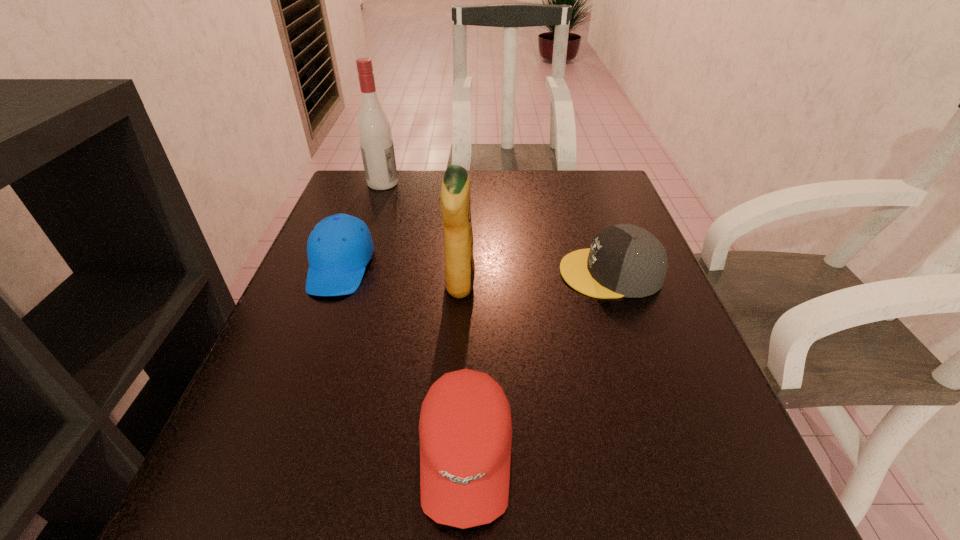
Where is `the tallest object`? The image size is (960, 540). the tallest object is located at coordinates (374, 130).

Where is `alcohol`? Image resolution: width=960 pixels, height=540 pixels. alcohol is located at coordinates (374, 130).

What are the coordinates of `the fourth shortest object` in the screenshot? It's located at (455, 206).

Locate an element on the screen. the leftmost cap is located at coordinates (339, 247).

What are the coordinates of `the rightmost cap` in the screenshot? It's located at (624, 260).

The height and width of the screenshot is (540, 960). I want to click on the second cap from left to right, so click(x=465, y=428).

This screenshot has height=540, width=960. Find the location of `the nearest cap`. the nearest cap is located at coordinates (465, 428).

Find the location of a particular element. This screenshot has height=540, width=960. vacant region located on the label of the tallest object is located at coordinates (533, 183).

The image size is (960, 540). In order to click on free space located on the label of the detergent in this screenshot , I will do `click(554, 285)`.

Find the location of `free spot located 0.180m on the front-facing side of the leftmost cap`. free spot located 0.180m on the front-facing side of the leftmost cap is located at coordinates (300, 375).